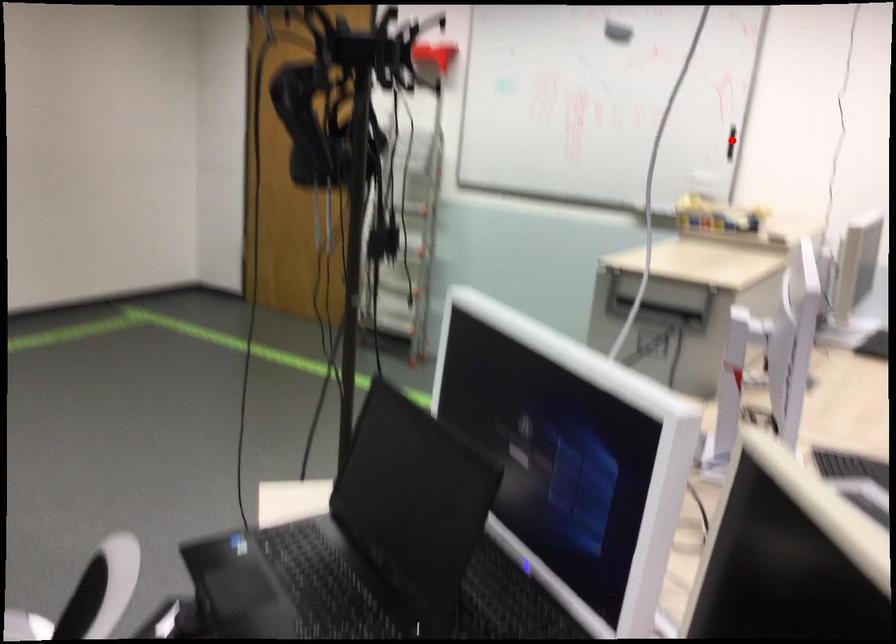
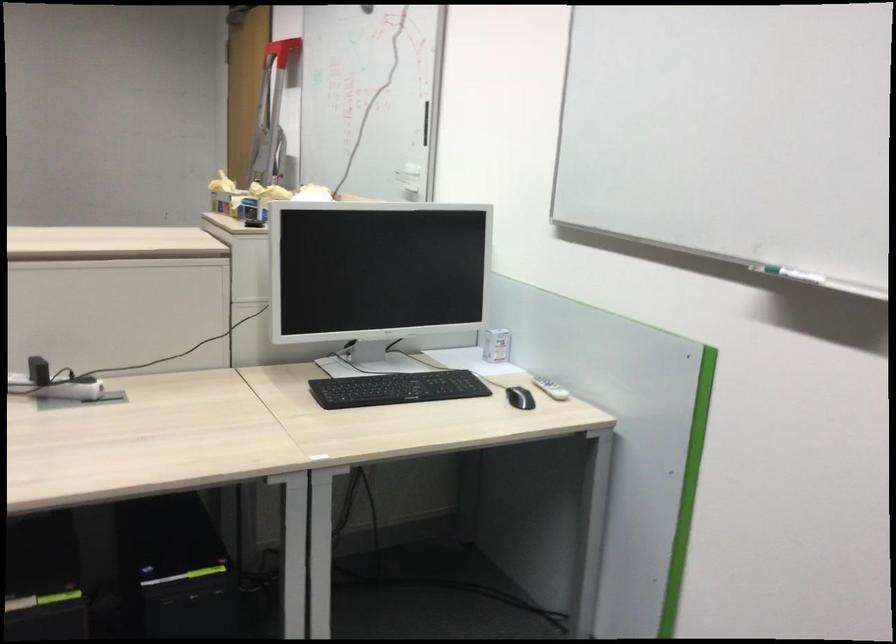
In the second image, find the point that corresponds to the highlighted location in the first image.

(426, 122)